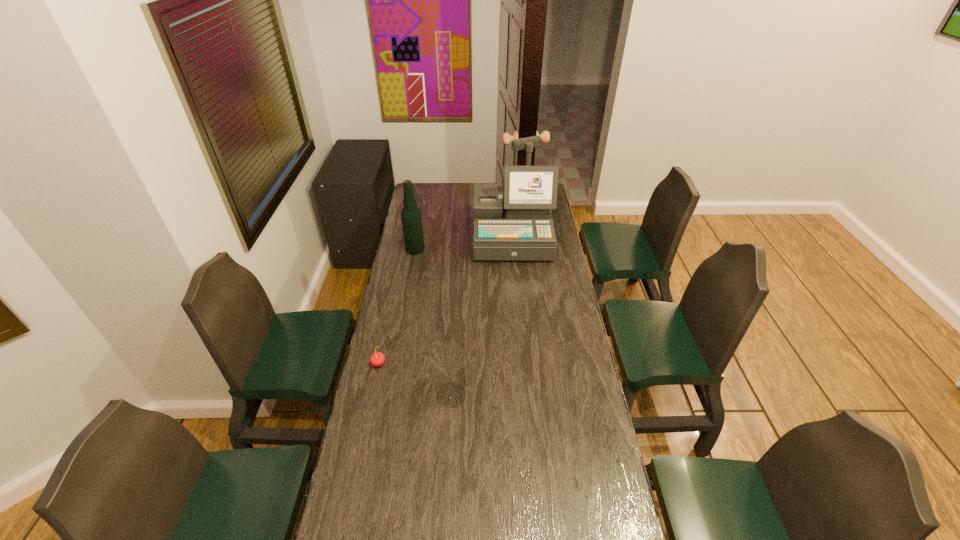
Where is `blank region between the third object from left to right and the tallest object`? The width and height of the screenshot is (960, 540). blank region between the third object from left to right and the tallest object is located at coordinates (481, 316).

Where is `free space between the third tallest object and the shortest object`? Image resolution: width=960 pixels, height=540 pixels. free space between the third tallest object and the shortest object is located at coordinates (415, 380).

You are a GUI agent. You are given a task and a screenshot of the screen. Output one action in this format:
    pyautogui.click(x=<x>, y=<y>)
    Task: Click on the vacant space that's between the shortest object and the tallest object
    The height and width of the screenshot is (540, 960).
    Given the screenshot: What is the action you would take?
    pyautogui.click(x=445, y=300)

Identify the location of vacant region between the tallest object and the second tallest object. [x=464, y=244].

Identify the location of unoccupied area between the tallest object and the third farthest object. (445, 300).

Where is `empty location between the second object from right to left and the cherry`? This screenshot has width=960, height=540. empty location between the second object from right to left and the cherry is located at coordinates (415, 380).

Where is `unoccupied position between the third tallest object and the second tallest object`? Image resolution: width=960 pixels, height=540 pixels. unoccupied position between the third tallest object and the second tallest object is located at coordinates (433, 322).

You are a GUI agent. You are given a task and a screenshot of the screen. Output one action in this format:
    pyautogui.click(x=<x>, y=<y>)
    Task: Click on the object that is the closest to the cherry
    The width and height of the screenshot is (960, 540).
    Given the screenshot: What is the action you would take?
    (448, 358)

Where is `the closest object to the alcohol`? Image resolution: width=960 pixels, height=540 pixels. the closest object to the alcohol is located at coordinates (x=518, y=226).

This screenshot has width=960, height=540. Find the location of `free point that satisfies the following two spatial constraints: 1. on the front side of the shortest object; 2. on the right side of the third tallest object`. free point that satisfies the following two spatial constraints: 1. on the front side of the shortest object; 2. on the right side of the third tallest object is located at coordinates (372, 395).